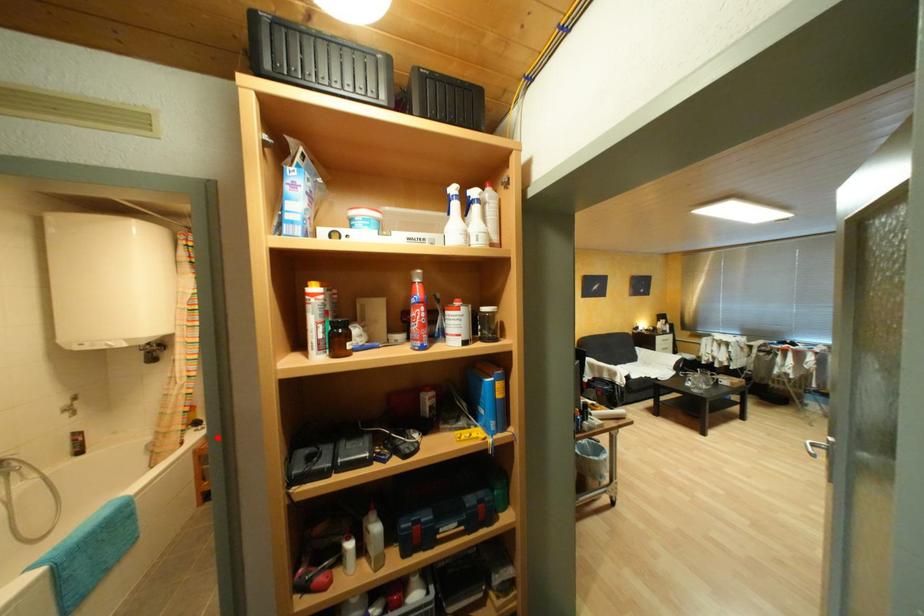
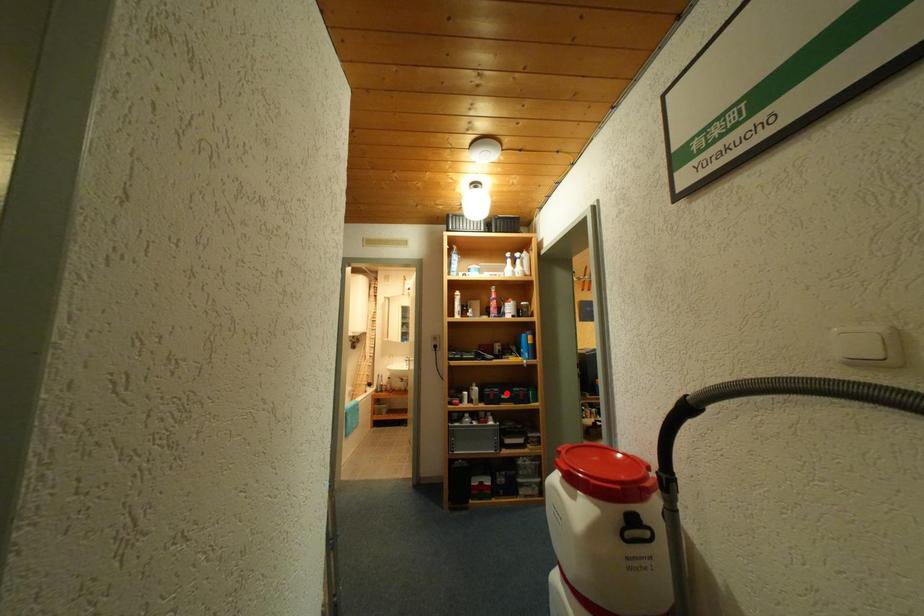
I am providing you with two images of the same scene from different viewpoints. A red point is marked on the first image and another point is marked on the second image. Is the marked point in image1 the same physical position as the marked point in image2?

No